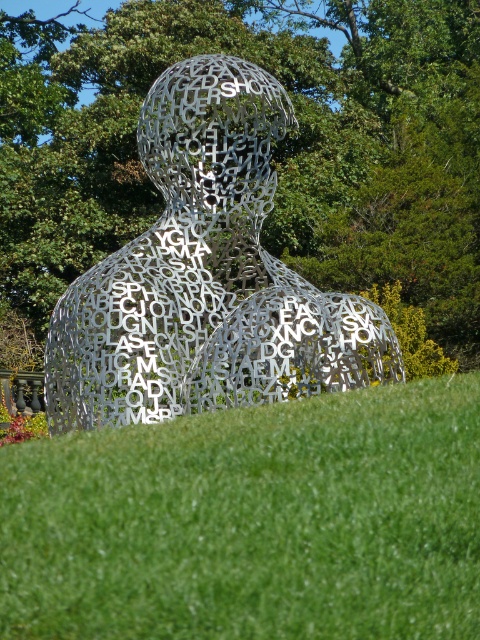
You are standing in front of the sculpture and notice two points marked on it. The first point is at coordinates point [362,564] and the second is at point [211,180]. Which point would appear closer to you when looking at the sculpture?

Point [362,564] is closer to the viewer than point [211,180], so the first point would appear closer when looking at the sculpture.

You are planning to place a new bench in the park. The bench requires a space larger than the metallic silver sculpture at center. Based on the scene, is the green grass at center a suitable location for the bench?

The green grass at center has a larger size compared to the metallic silver sculpture at center, so yes, the green grass at center is a suitable location for the bench since it is larger than the sculpture and can accommodate the bench.